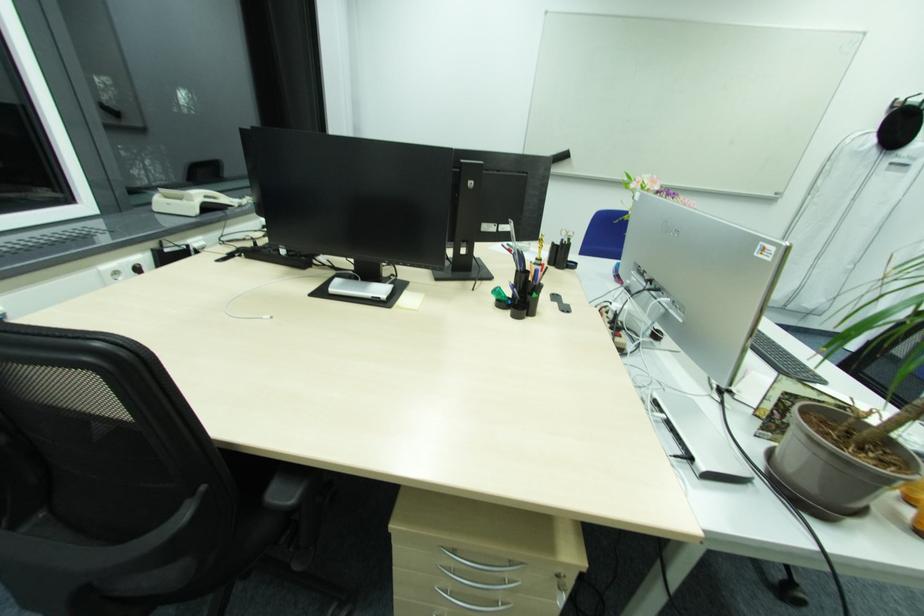
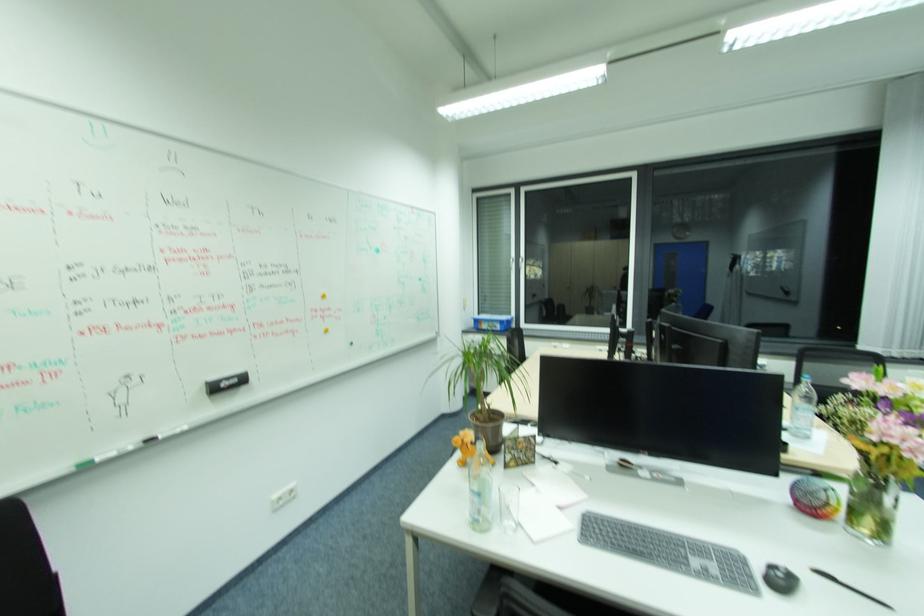
Where in the second image is the point corresponding to point 477,184 from the first image?

(666, 334)